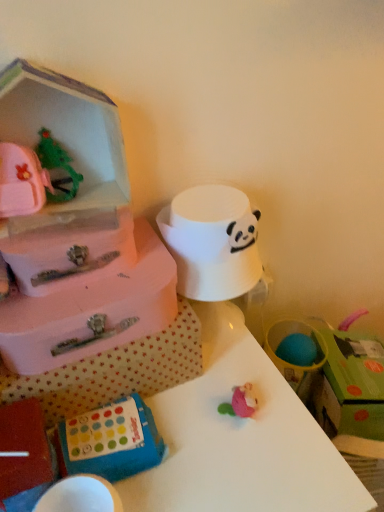
Identify the location of vacant space to the right of blue rubbery toy at lower center. The image size is (384, 512). (218, 439).